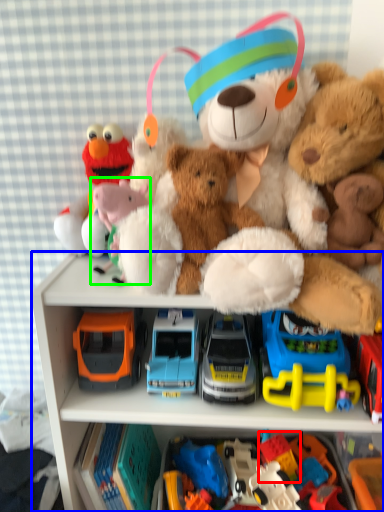
Question: Which object is positioned farthest from toy (highlighted by a red box)? Select from cabinetry (highlighted by a blue box) and toy (highlighted by a green box).

Choices:
 (A) cabinetry
 (B) toy

Answer: (B)